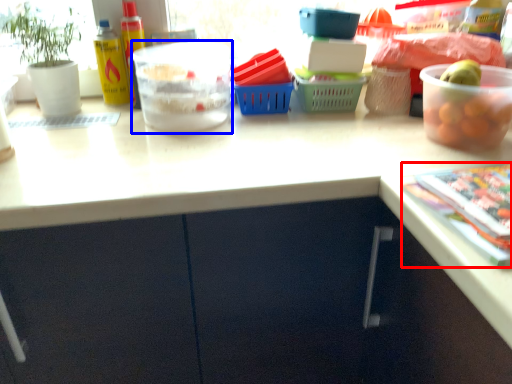
Question: Which object is further to the camera taking this photo, magazine (highlighted by a red box) or bowl (highlighted by a blue box)?

Choices:
 (A) magazine
 (B) bowl

Answer: (B)